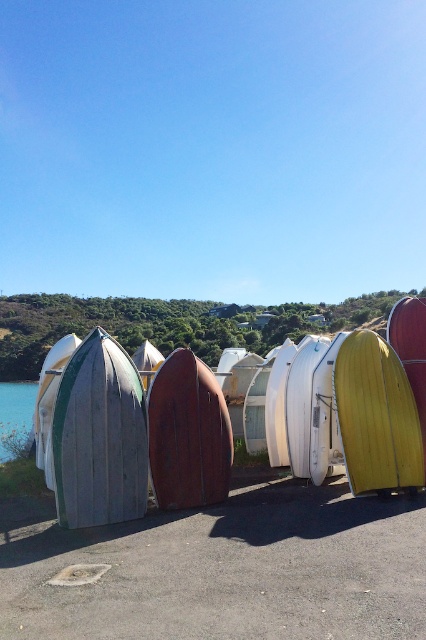
Question: Is wooden surfboard at left smaller than white matte surfboard at center?

Choices:
 (A) yes
 (B) no

Answer: (B)

Question: Can you confirm if yellow matte surfboard at center is thinner than transparent glass water at lower left?

Choices:
 (A) no
 (B) yes

Answer: (B)

Question: Among these points, which one is nearest to the camera?

Choices:
 (A) (417, 452)
 (B) (22, 392)
 (C) (290, 385)

Answer: (A)

Question: Can you confirm if wooden surfboard at left is wider than rusty wood surfboard at center?

Choices:
 (A) no
 (B) yes

Answer: (A)

Question: Estimate the real-world distances between objects in this image. Which object is closer to the transparent glass water at lower left?

Choices:
 (A) rusty wood surfboard at center
 (B) wooden surfboard at left
 (C) white matte surfboard at center

Answer: (B)

Question: Which object is closer to the camera taking this photo?

Choices:
 (A) white matte surfboard at center
 (B) transparent glass water at lower left
 (C) rusty wood surfboard at center
 (D) white matte surfboard at left

Answer: (D)